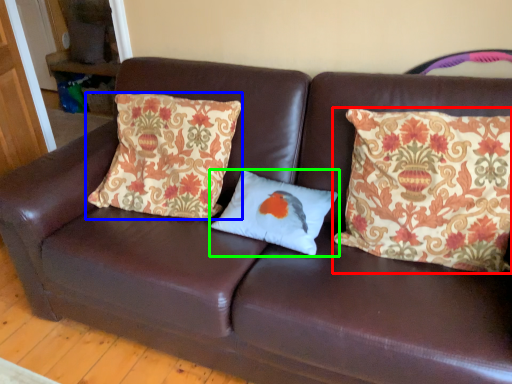
Question: Which object is positioned farthest from pillow (highlighted by a red box)? Select from pillow (highlighted by a blue box) and pillow (highlighted by a green box).

Choices:
 (A) pillow
 (B) pillow

Answer: (A)